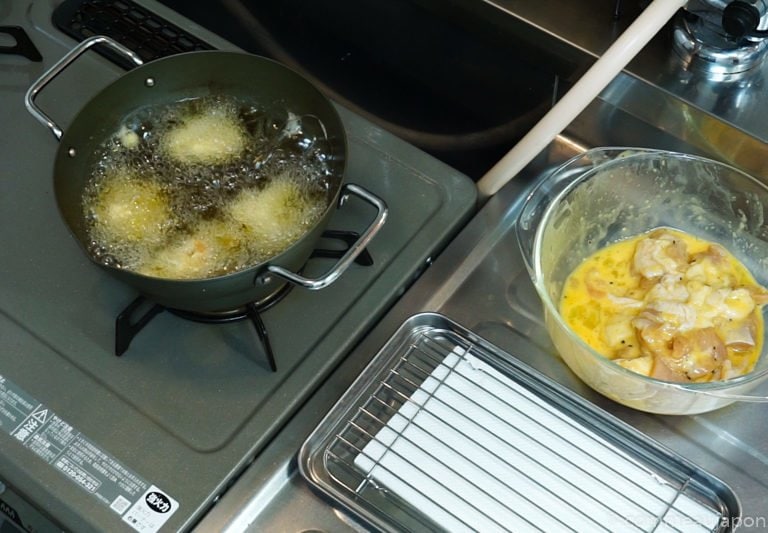
You are a GUI agent. You are given a task and a screenshot of the screen. Output one action in this format:
    pyautogui.click(x=<x>, y=<y>)
    Task: Click on the black pot
    Image resolution: width=768 pixels, height=533 pixels.
    Given the screenshot: What is the action you would take?
    pyautogui.click(x=219, y=300)